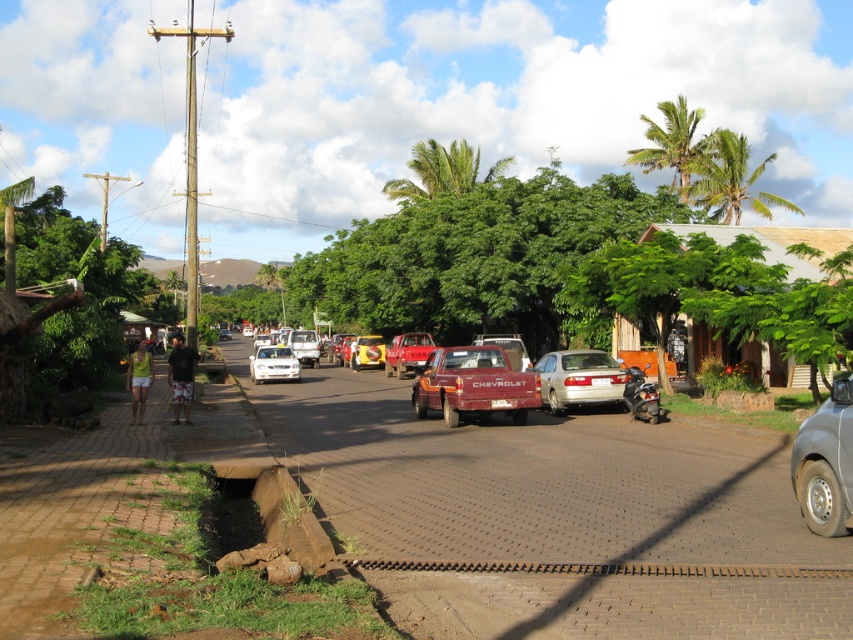
You are a pedestrian standing on the grass near the curb in the street scene. You see a red matte pickup truck at center and a matte red truck at center. Which truck is closer to you?

The red matte pickup truck at center is closer to you because it is positioned under the matte red truck at center, meaning it is in front.

You are standing at the center of the street and want to walk towards both points. Which point, point [630,387] or point [316,337], will you reach first?

Point [630,387] is closer to the viewer, so you will reach point [630,387] first.